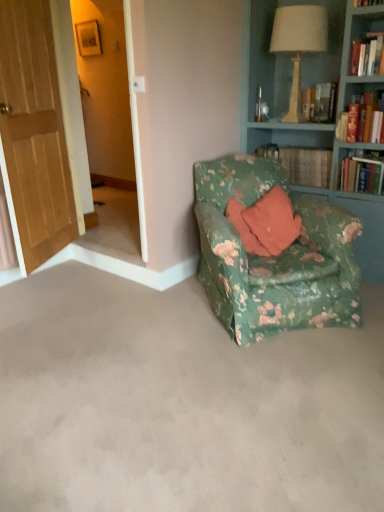
You are a GUI agent. You are given a task and a screenshot of the screen. Output one action in this format:
    pyautogui.click(x=<x>, y=<y>)
    Task: Click on the free spot in front of floral fabric armchair at center
    The height and width of the screenshot is (512, 384).
    Given the screenshot: What is the action you would take?
    pyautogui.click(x=261, y=385)